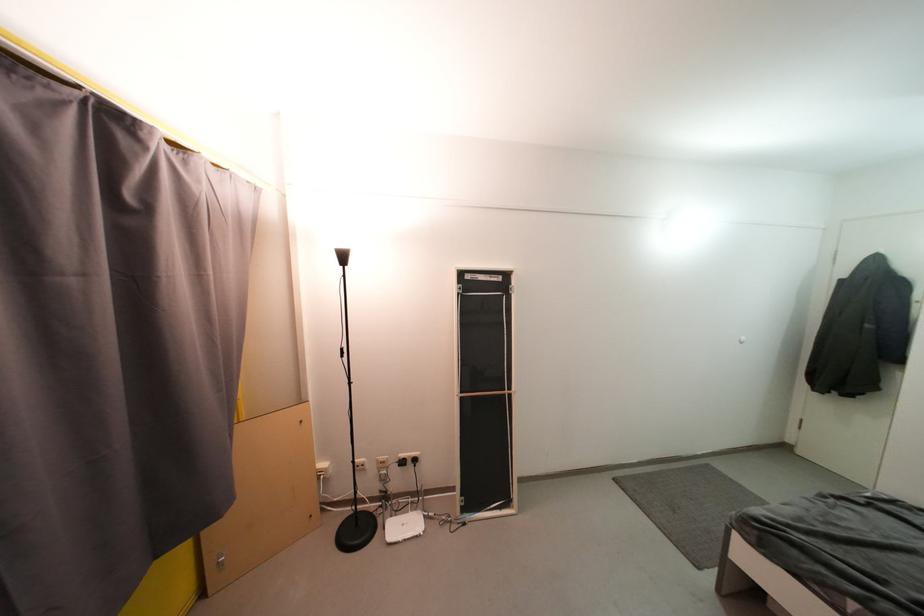
The width and height of the screenshot is (924, 616). What do you see at coordinates (220, 561) in the screenshot?
I see `the metal cabinet handle` at bounding box center [220, 561].